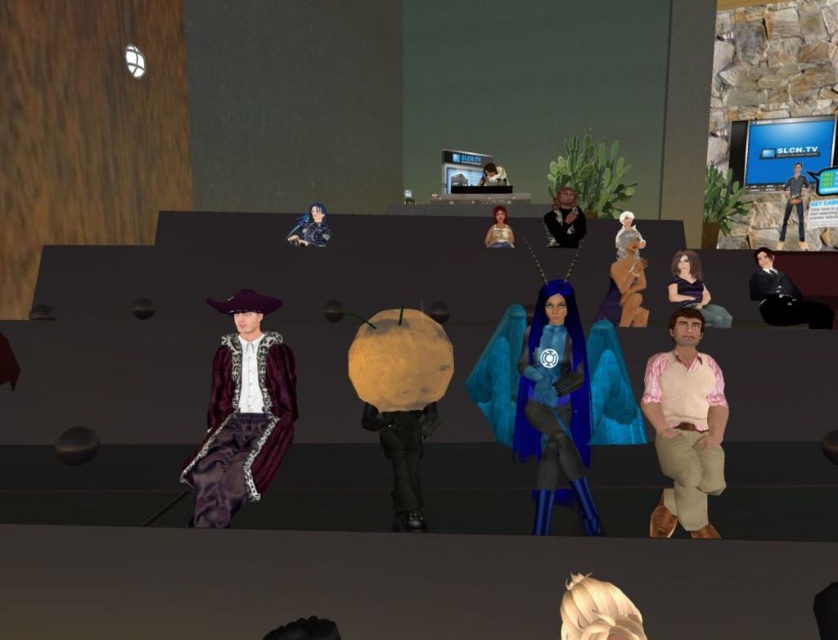
Does blue glossy cape at center have a smaller size compared to matte black character at upper center?

Actually, blue glossy cape at center might be larger than matte black character at upper center.

Between point (559, 435) and point (324, 211), which one is positioned behind?

The point (324, 211) is more distant.

Where is `blue glossy cape at center`? The height and width of the screenshot is (640, 838). blue glossy cape at center is located at coordinates (555, 396).

Based on the photo, is matte gold dress at center to the left of matte black jacket at upper center from the viewer's perspective?

Incorrect, matte gold dress at center is not on the left side of matte black jacket at upper center.

Does matte gold dress at center appear under matte black jacket at upper center?

Yes, matte gold dress at center is below matte black jacket at upper center.

Describe the element at coordinates (627, 282) in the screenshot. The image size is (838, 640). I see `matte gold dress at center` at that location.

I want to click on matte gold dress at center, so click(627, 282).

Can you confirm if matte black character at upper center is taller than denim jeans at right?

Indeed, matte black character at upper center has a greater height compared to denim jeans at right.

Does matte black character at upper center appear under denim jeans at right?

Correct, matte black character at upper center is located below denim jeans at right.

Does point (329, 234) come closer to viewer compared to point (785, 227)?

Yes, it is.

Where is `matte black character at upper center`? The height and width of the screenshot is (640, 838). matte black character at upper center is located at coordinates (309, 228).